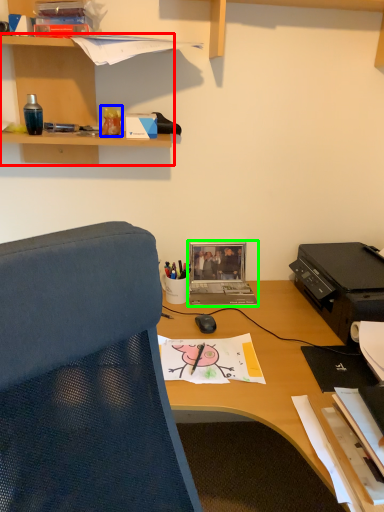
Question: Which object is the closest to the shelf (highlighted by a red box)? Choose among these: stationery (highlighted by a blue box) or laptop (highlighted by a green box).

Choices:
 (A) stationery
 (B) laptop

Answer: (A)